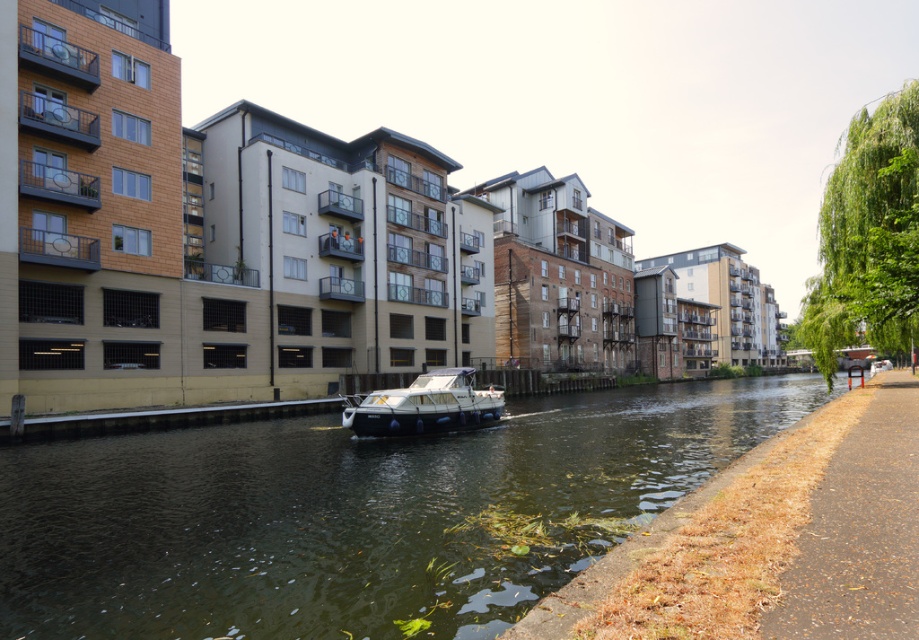
Can you confirm if brown asphalt path at lower right is positioned to the left of white glossy boat at center?

Incorrect, brown asphalt path at lower right is not on the left side of white glossy boat at center.

Is point (875, 380) positioned before point (420, 394)?

No, (875, 380) is behind (420, 394).

I want to click on brown asphalt path at lower right, so click(x=860, y=531).

Which of these two, greenish water at center or white glossy boat at center, stands taller?

With more height is white glossy boat at center.

Based on the photo, can you confirm if greenish water at center is wider than white glossy boat at center?

Yes, greenish water at center is wider than white glossy boat at center.

Is point (599, 502) in front of point (365, 376)?

That is True.

At what (x,y) coordinates should I click in order to perform the action: click on greenish water at center. Please return your answer as a coordinate pair (x, y). Looking at the image, I should click on (356, 515).

Which is below, greenish water at center or brown asphalt path at lower right?

greenish water at center is lower down.

Can you confirm if greenish water at center is smaller than brown asphalt path at lower right?

No, greenish water at center is not smaller than brown asphalt path at lower right.

Identify the location of greenish water at center. (356, 515).